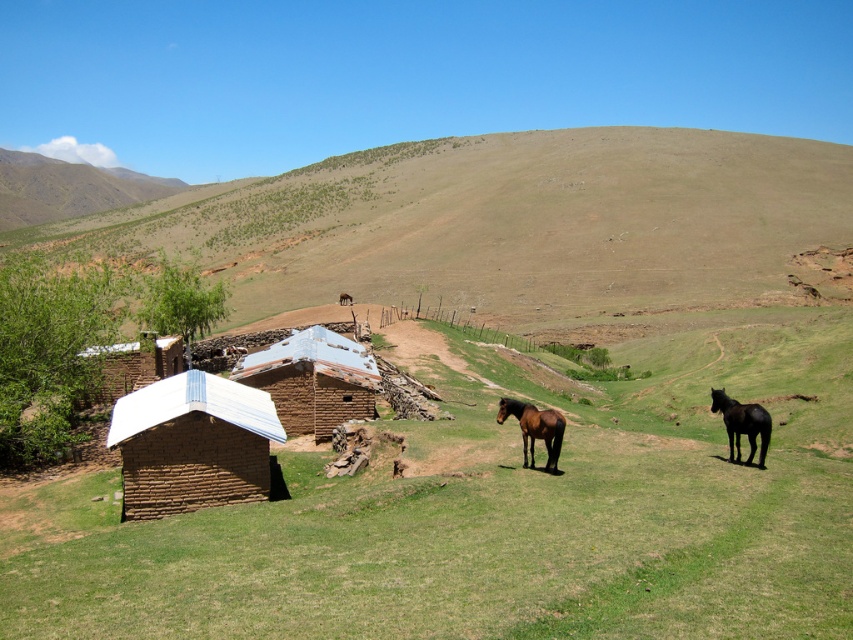
You are standing at the base of the grassy hillside where the two horses are located. You see two points marked in the image. Which point, point (262, 506) or point (296, 404), is closer to you?

Point (262, 506) is closer to you because it is in front of point (296, 404).

From the picture: You are a farmer who needs to move the black glossy horse at right to the brown mud brick field at center. Based on their positions, which direction should you guide the horse to go?

The brown mud brick field at center is to the right of the black glossy horse at right, so you should guide the horse to move to the left to reach the field.

You are a farmer who needs to transport hay from the barn to the field. You see the brown mud brick field at center and the black glossy horse at right. Which direction should you head to reach the field from the horse?

The brown mud brick field at center is located below the black glossy horse at right, so you should head downward from the horse to reach the field.